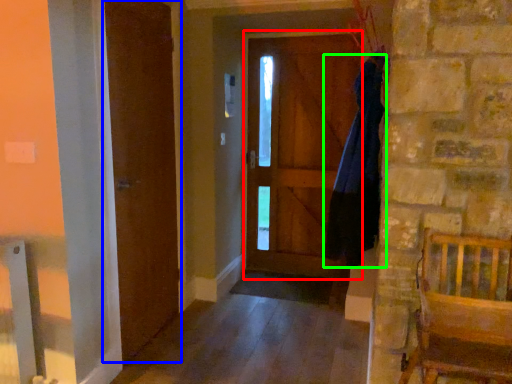
Question: Which object is positioned closest to screen door (highlighted by a red box)? Select from barn door (highlighted by a blue box) and dress (highlighted by a green box).

Choices:
 (A) barn door
 (B) dress

Answer: (B)